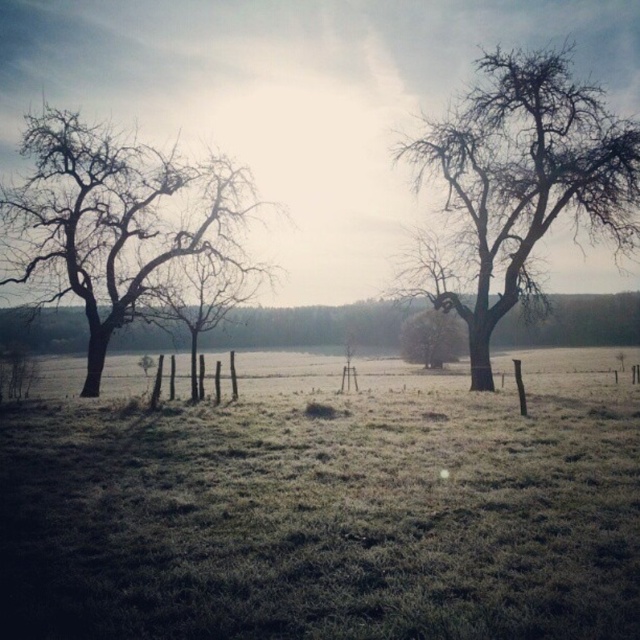
From the picture: Is bare wood tree at upper right smaller than brown matte tree at center?

Incorrect, bare wood tree at upper right is not smaller in size than brown matte tree at center.

Does bare wood tree at upper right have a lesser height compared to brown matte tree at center?

Incorrect, bare wood tree at upper right's height does not fall short of brown matte tree at center's.

What do you see at coordinates (525, 179) in the screenshot? I see `bare wood tree at upper right` at bounding box center [525, 179].

Locate an element on the screen. bare wood tree at upper right is located at coordinates (525, 179).

What do you see at coordinates (125, 232) in the screenshot?
I see `bare branches at left` at bounding box center [125, 232].

Is bare branches at left positioned before bare wood tree at upper right?

Yes, it is.

Between point (124, 280) and point (636, 163), which one is positioned in front?

Point (636, 163)

This screenshot has width=640, height=640. I want to click on bare branches at left, so click(x=125, y=232).

Locate an element on the screen. bare branches at left is located at coordinates (125, 232).

Is bare branches at left to the left of brown matte tree at center from the viewer's perspective?

Correct, you'll find bare branches at left to the left of brown matte tree at center.

Between point (136, 236) and point (419, 336), which one is positioned in front?

Point (136, 236) is in front.

The height and width of the screenshot is (640, 640). In order to click on bare branches at left in this screenshot , I will do 125,232.